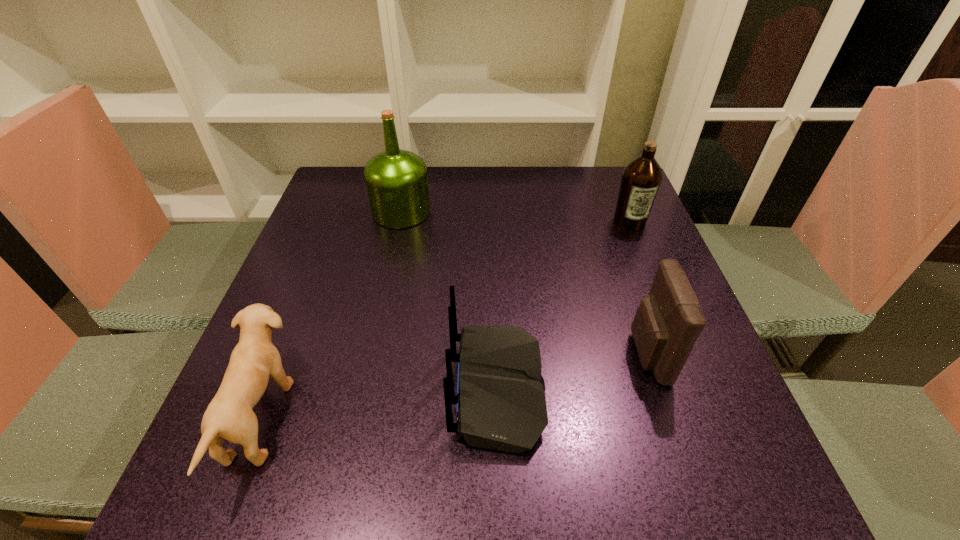
Find the location of `blank region between the leftmost object and the third object from right to left`. blank region between the leftmost object and the third object from right to left is located at coordinates (379, 403).

The image size is (960, 540). Identify the location of vacant space that's between the leftmost object and the shorter olive oil. (445, 319).

This screenshot has height=540, width=960. I want to click on free space between the third object from left to right and the taller olive oil, so click(x=449, y=300).

Where is `empty space between the shorter olive oil and the pouch`? The image size is (960, 540). empty space between the shorter olive oil and the pouch is located at coordinates (638, 287).

Locate an element on the screen. free area in between the fourth shortest object and the tallest object is located at coordinates (516, 217).

Find the location of a particular element. This screenshot has width=960, height=540. unoccupied position between the pouch and the second object from left to right is located at coordinates (524, 282).

Find the location of `empty location between the leftmost object and the pouch`. empty location between the leftmost object and the pouch is located at coordinates (454, 386).

Image resolution: width=960 pixels, height=540 pixels. Find the location of `vacant area that lies between the pouch and the leftmost object`. vacant area that lies between the pouch and the leftmost object is located at coordinates (454, 386).

What are the coordinates of `free space between the pouch and the leftmost object` in the screenshot? It's located at (454, 386).

I want to click on free space between the router and the leftmost object, so click(379, 403).